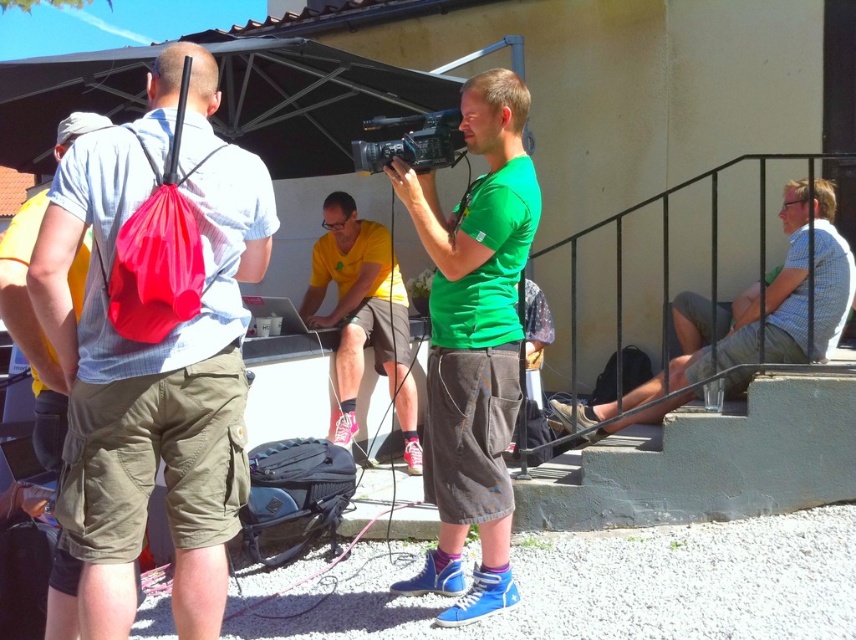
Find the location of `matte nylon backpack at left`. matte nylon backpack at left is located at coordinates (153, 358).

Can you confirm if matte nylon backpack at left is smaller than yellow fabric shirt at center?

Correct, matte nylon backpack at left occupies less space than yellow fabric shirt at center.

Consider the image. Who is more forward, (94, 150) or (342, 196)?

Point (94, 150) is in front.

Image resolution: width=856 pixels, height=640 pixels. In order to click on matte nylon backpack at left in this screenshot , I will do `click(153, 358)`.

Does matte nylon backpack at left appear on the left side of white checkered shirt at right?

Indeed, matte nylon backpack at left is positioned on the left side of white checkered shirt at right.

Is point (156, 132) closer to viewer compared to point (765, 333)?

Yes, point (156, 132) is in front of point (765, 333).

Where is `matte nylon backpack at left`? This screenshot has width=856, height=640. matte nylon backpack at left is located at coordinates (153, 358).

Who is lower down, matte nylon backpack at left or black plastic video camera at center?

matte nylon backpack at left is below.

Which is behind, point (74, 442) or point (435, 113)?

The point (435, 113) is behind.

Identify the location of matte nylon backpack at left. (153, 358).

Where is `matte nylon backpack at left`? The height and width of the screenshot is (640, 856). matte nylon backpack at left is located at coordinates (153, 358).